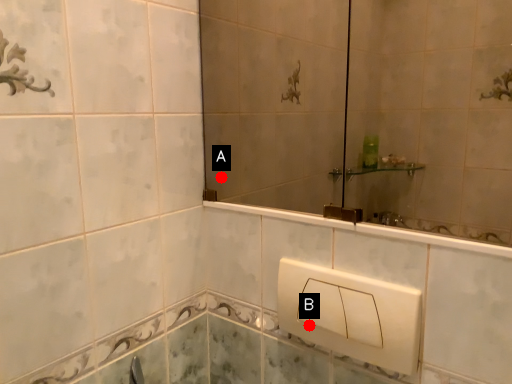
Question: Two points are circled on the image, labeled by A and B beside each circle. Which of the following is the closest to the observer?

Choices:
 (A) A is closer
 (B) B is closer

Answer: (B)